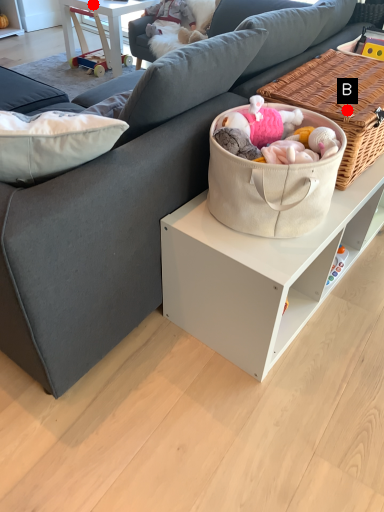
Question: Two points are circled on the image, labeled by A and B beside each circle. Which of the following is the farthest from the observer?

Choices:
 (A) A is further
 (B) B is further

Answer: (A)